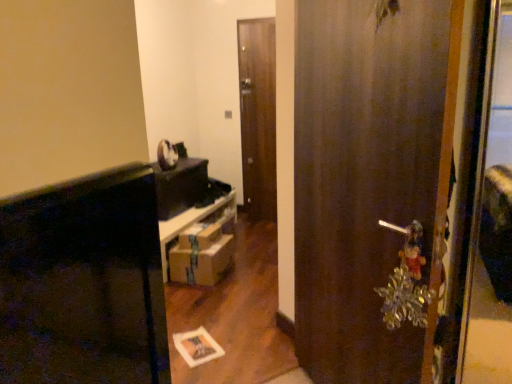
Question: Could brown cardboard drawer at center be considered to be inside brown cardboard boxes at center?

Choices:
 (A) no
 (B) yes

Answer: (A)

Question: Can you confirm if brown cardboard boxes at center is thinner than brown cardboard drawer at center?

Choices:
 (A) no
 (B) yes

Answer: (B)

Question: From a real-world perspective, is brown cardboard boxes at center physically above brown cardboard drawer at center?

Choices:
 (A) yes
 (B) no

Answer: (A)

Question: Can you confirm if brown cardboard boxes at center is shorter than brown cardboard drawer at center?

Choices:
 (A) no
 (B) yes

Answer: (B)

Question: Does brown cardboard boxes at center turn towards brown cardboard drawer at center?

Choices:
 (A) yes
 (B) no

Answer: (B)

Question: Considering the positions of wooden door at center, which ranks as the 1th door in back-to-front order, and brown cardboard boxes at center in the image, is wooden door at center, which ranks as the 1th door in back-to-front order, taller or shorter than brown cardboard boxes at center?

Choices:
 (A) tall
 (B) short

Answer: (A)

Question: In terms of size, does wooden door at center, which ranks as the 1th door in back-to-front order, appear bigger or smaller than brown cardboard boxes at center?

Choices:
 (A) small
 (B) big

Answer: (B)

Question: From a real-world perspective, is wooden door at center, which is the second door in front-to-back order, above or below brown cardboard boxes at center?

Choices:
 (A) above
 (B) below

Answer: (A)

Question: In the image, is wooden door at center, which is the second door from right to left, on the left side or the right side of brown cardboard boxes at center?

Choices:
 (A) right
 (B) left

Answer: (A)

Question: Is wooden door at center, which is the second door in front-to-back order, situated inside wooden door at center, which appears as the 2th door when viewed from the left, or outside?

Choices:
 (A) outside
 (B) inside

Answer: (A)

Question: Visually, is wooden door at center, which ranks as the 1th door in back-to-front order, positioned to the left or to the right of wooden door at center, the first door viewed from the right?

Choices:
 (A) left
 (B) right

Answer: (A)

Question: Does point (274, 89) appear closer or farther from the camera than point (314, 375)?

Choices:
 (A) farther
 (B) closer

Answer: (A)

Question: In the image, is wooden door at center, which is the second door from right to left, positioned in front of or behind wooden door at center, which is counted as the 1th door, starting from the front?

Choices:
 (A) front
 (B) behind

Answer: (B)

Question: From the image's perspective, relative to brown cardboard drawer at center, is wooden door at center, which ranks as the first door in left-to-right order, above or below?

Choices:
 (A) below
 (B) above

Answer: (B)

Question: Is wooden door at center, which ranks as the 1th door in back-to-front order, situated inside brown cardboard drawer at center or outside?

Choices:
 (A) outside
 (B) inside

Answer: (A)